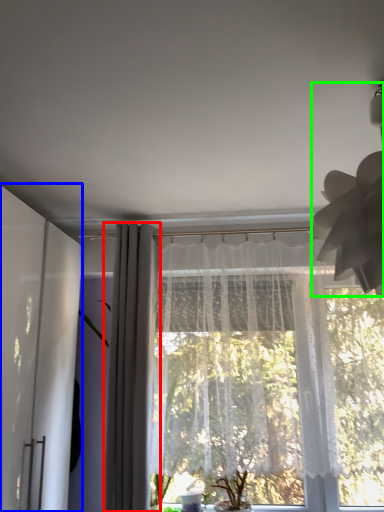
Question: Which object is positioned closest to curtain (highlighted by a red box)? Select from screen door (highlighted by a blue box) and lamp (highlighted by a green box).

Choices:
 (A) screen door
 (B) lamp

Answer: (A)